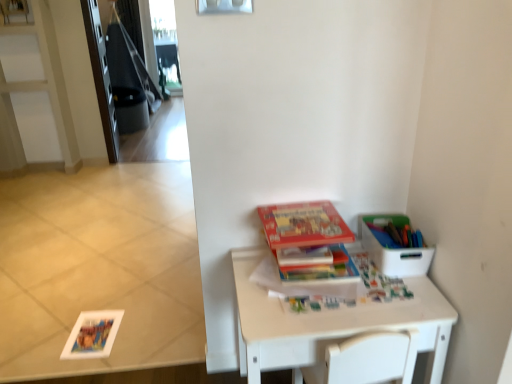
Identify the location of free space above white matte table at lower right (from a real-world perspective). Image resolution: width=512 pixels, height=384 pixels. coord(328,283).